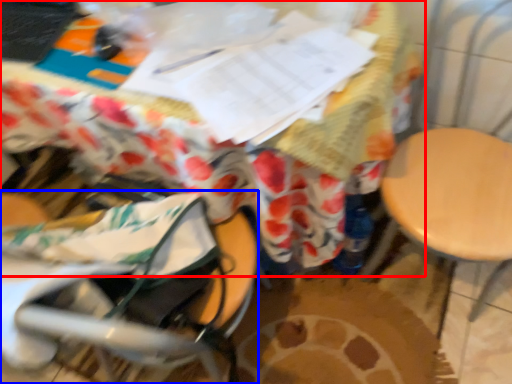
Question: Which of the following is the farthest to the observer, table (highlighted by a red box) or baby carriage (highlighted by a blue box)?

Choices:
 (A) table
 (B) baby carriage

Answer: (A)